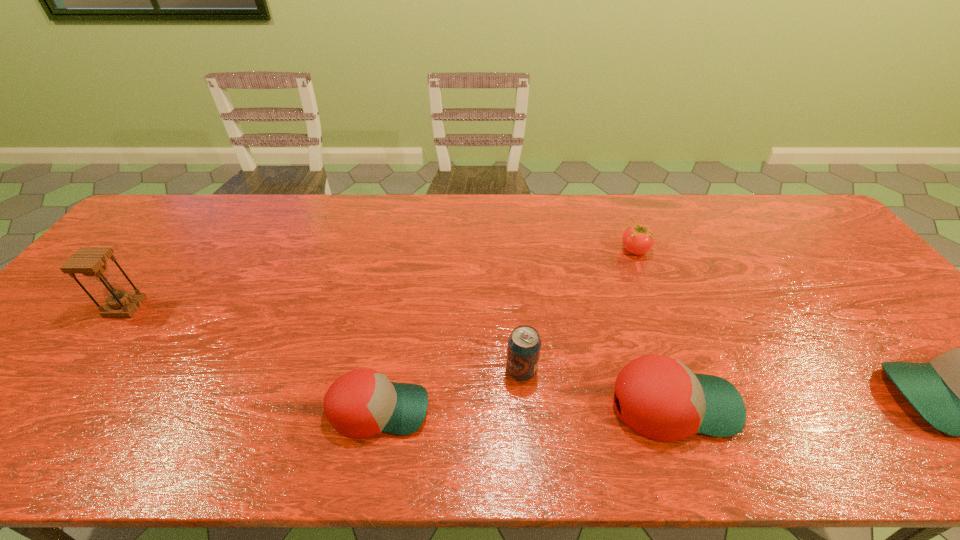
Observe the arrangement of all baseball caps in the image. To keep them evenly spaced, where would you place another baseball cap on the left? Please locate a free space. Please provide its 2D coordinates. Your answer should be formatted as a tuple, i.e. [(x, y)], where the tuple contains the x and y coordinates of a point satisfying the conditions above.

[(81, 414)]